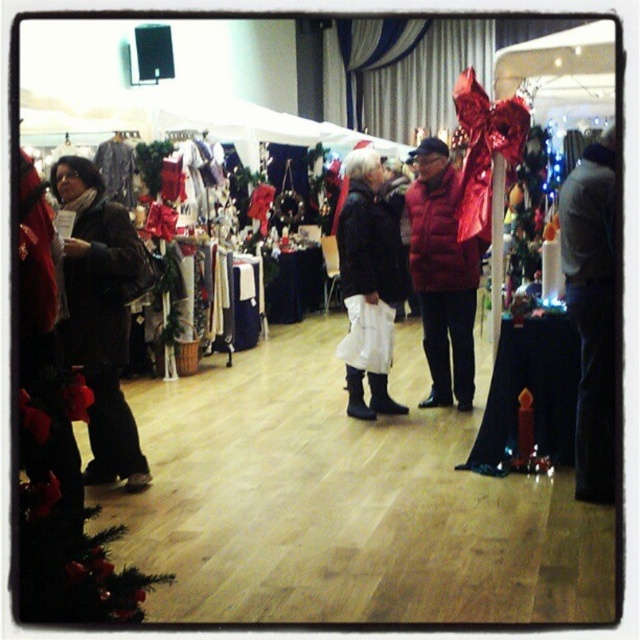
You are a customer at the market and want to approach the person wearing the matte black jacket at left and the matte black boots at center. Which item should you walk towards first if you want to greet them?

You should walk towards the matte black jacket at left first because it is closer to you than the matte black boots at center, so reaching it first would allow you to greet them appropriately.

You are a customer at the market and want to buy both the red down jacket at center and the matte black boots at center. However, your shopping bag can only hold one item at a time. Which item should you pick first if you want to ensure the bag can fit the second item afterward?

The red down jacket at center is larger in size than the matte black boots at center, so you should pick the red down jacket at center first. This way, the smaller matte black boots at center will fit in the remaining space afterward.